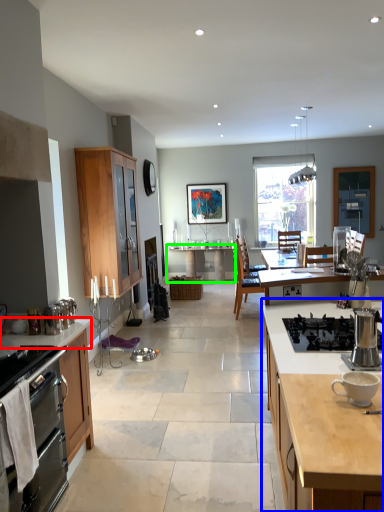
Question: Which object is the closest to the countertop (highlighted by a red box)? Choose among these: cabinetry (highlighted by a blue box) or table (highlighted by a green box).

Choices:
 (A) cabinetry
 (B) table

Answer: (A)